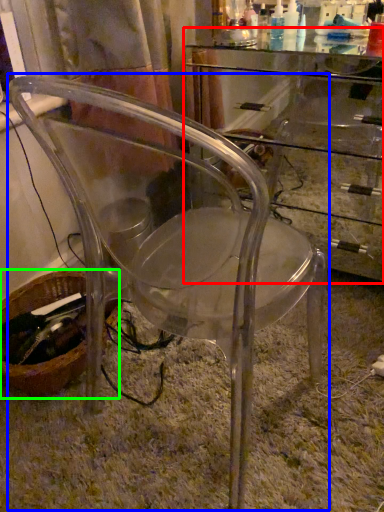
Question: Based on their relative distances, which object is nearer to computer desk (highlighted by a red box)? Choose from chair (highlighted by a blue box) and basket (highlighted by a green box).

Choices:
 (A) chair
 (B) basket

Answer: (A)